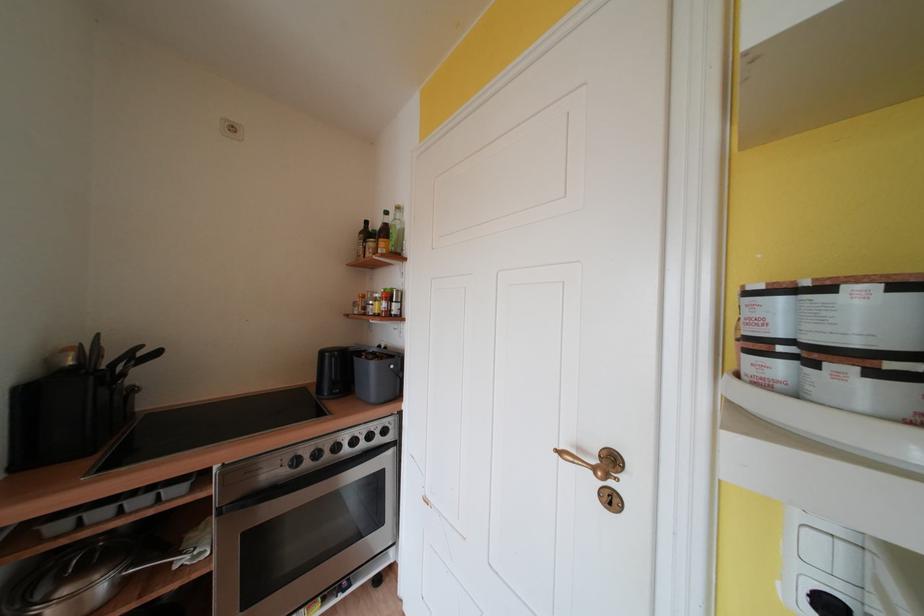
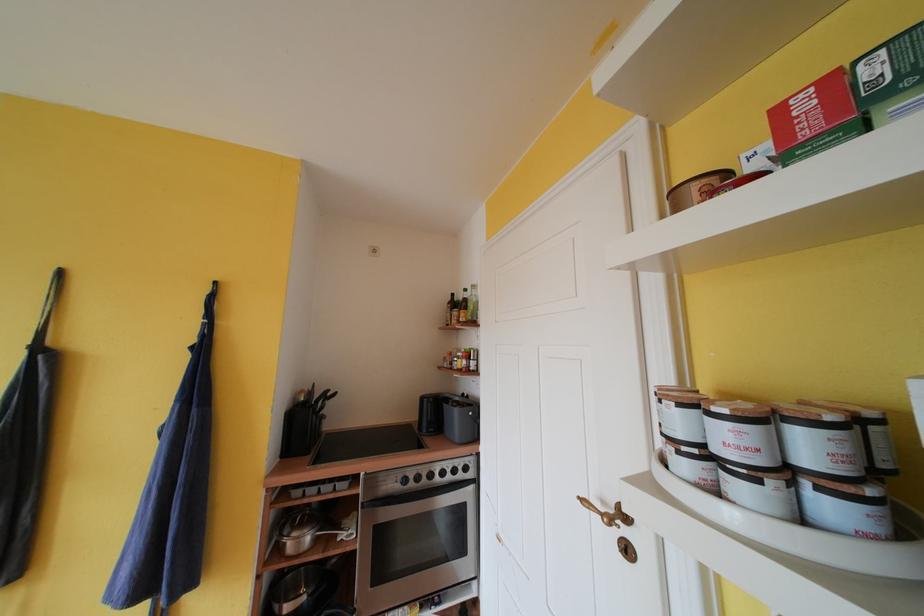
Find the pixel in the second image that matches point 865,283 in the first image.

(675, 400)